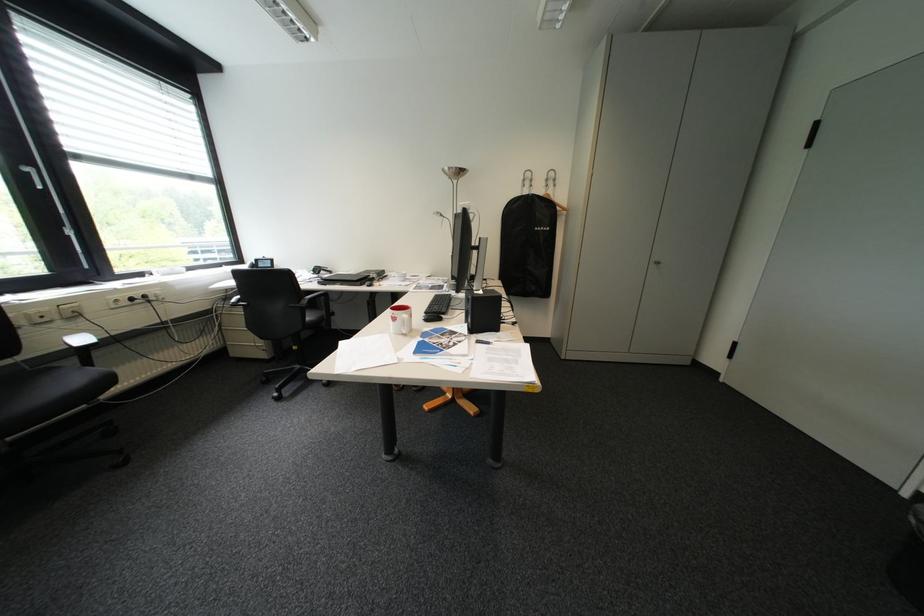
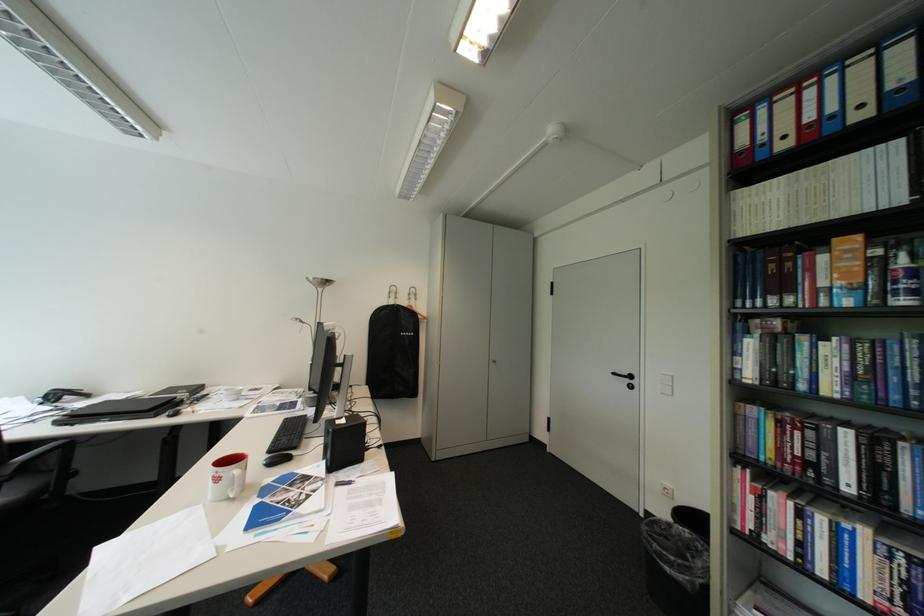
Where in the second image is the point corresponding to (x=407, y=320) from the first image?

(228, 480)